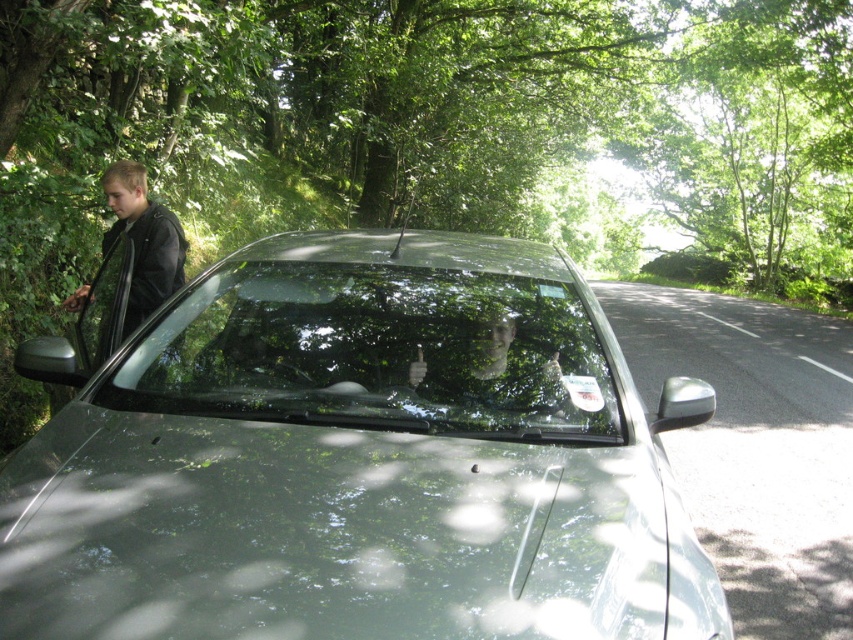
Between point (451, 321) and point (166, 285), which one is positioned behind?

The point (166, 285) is more distant.

Is the position of matte black face at center less distant than that of black leather jacket at left?

Yes, it is.

This screenshot has width=853, height=640. I want to click on matte black face at center, so click(x=489, y=362).

I want to click on matte black face at center, so click(489, 362).

Does green leafy tree at upper center appear on the right side of black leather jacket at left?

Yes, green leafy tree at upper center is to the right of black leather jacket at left.

Does point (608, 22) come closer to viewer compared to point (108, 172)?

No, (608, 22) is further to viewer.

Measure the distance between point [761,257] and camera.

A distance of 122.30 feet exists between point [761,257] and camera.

Locate an element on the screen. The image size is (853, 640). green leafy tree at upper center is located at coordinates (426, 134).

Which is below, green leafy tree at upper center or clear glass windshield at center?

Positioned lower is clear glass windshield at center.

Is the position of green leafy tree at upper center less distant than that of clear glass windshield at center?

No, green leafy tree at upper center is further to the viewer.

The width and height of the screenshot is (853, 640). I want to click on green leafy tree at upper center, so click(x=426, y=134).